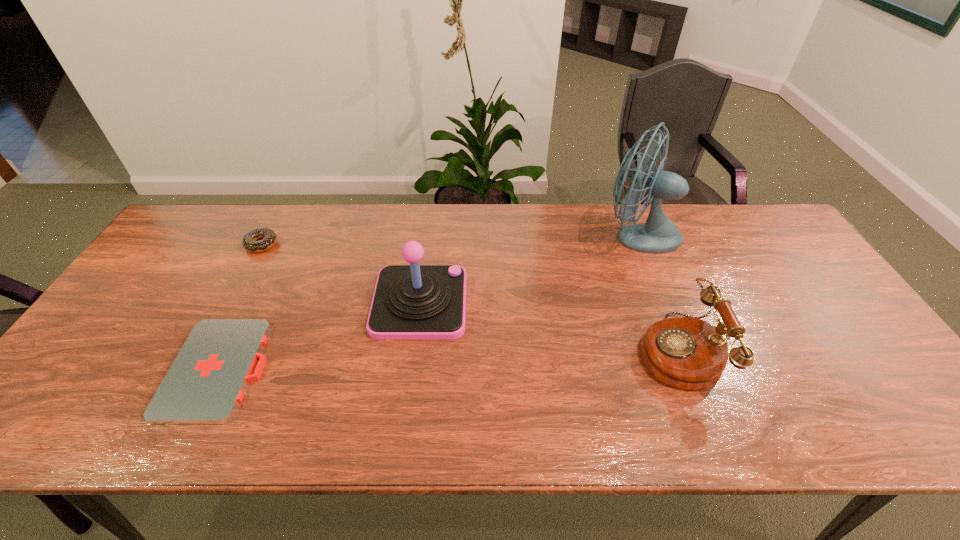
At what (x,y) coordinates should I click in order to perform the action: click on vacant area at the left edge. Please return your answer as a coordinate pair (x, y). Looking at the image, I should click on (71, 375).

Image resolution: width=960 pixels, height=540 pixels. Identify the location of free location at the right edge. (819, 325).

In the image, there is a desktop. At what (x,y) coordinates should I click in order to perform the action: click on free space at the near left corner. Please return your answer as a coordinate pair (x, y). Looking at the image, I should click on (70, 410).

Locate an element on the screen. The image size is (960, 540). free space between the telephone and the tallest object is located at coordinates (658, 293).

Image resolution: width=960 pixels, height=540 pixels. I want to click on blank region between the doughnut and the third tallest object, so click(468, 297).

Where is `vacant area that lies between the fourth tallest object and the tallest object`? This screenshot has width=960, height=540. vacant area that lies between the fourth tallest object and the tallest object is located at coordinates (450, 240).

Where is `free space that is in between the telephone and the fourth tallest object`? The width and height of the screenshot is (960, 540). free space that is in between the telephone and the fourth tallest object is located at coordinates (468, 297).

Identify the location of free space between the third object from left to right and the shortest object. (320, 336).

Identify the location of vacant area between the third shortest object and the shortest object. This screenshot has height=540, width=960. (447, 360).

You are a GUI agent. You are given a task and a screenshot of the screen. Output one action in this format:
    pyautogui.click(x=<x>, y=<y>)
    Task: Click on the free area in between the third tallest object and the first-aid kit
    This screenshot has width=960, height=540.
    Given the screenshot: What is the action you would take?
    pyautogui.click(x=447, y=360)